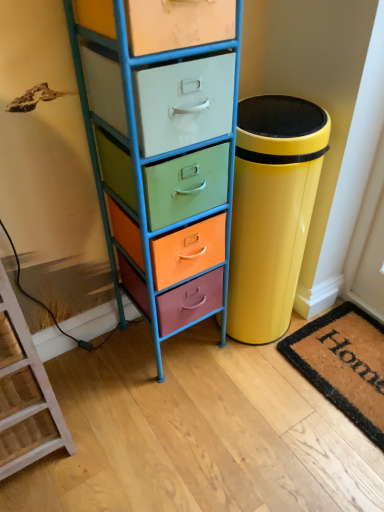
Question: Is wooden ladder at lower left closer to camera compared to coir doormat at lower right?

Choices:
 (A) no
 (B) yes

Answer: (B)

Question: Considering the relative positions of wooden ladder at lower left and coir doormat at lower right in the image provided, is wooden ladder at lower left to the right of coir doormat at lower right from the viewer's perspective?

Choices:
 (A) yes
 (B) no

Answer: (B)

Question: From the image's perspective, is wooden ladder at lower left under coir doormat at lower right?

Choices:
 (A) yes
 (B) no

Answer: (B)

Question: Is wooden ladder at lower left facing away from coir doormat at lower right?

Choices:
 (A) no
 (B) yes

Answer: (A)

Question: Could you tell me if wooden ladder at lower left is turned towards coir doormat at lower right?

Choices:
 (A) yes
 (B) no

Answer: (B)

Question: Does wooden ladder at lower left have a smaller size compared to coir doormat at lower right?

Choices:
 (A) yes
 (B) no

Answer: (B)

Question: Does glossy yellow trash can at right appear on the right side of wooden ladder at lower left?

Choices:
 (A) no
 (B) yes

Answer: (B)

Question: Is glossy yellow trash can at right looking in the opposite direction of wooden ladder at lower left?

Choices:
 (A) no
 (B) yes

Answer: (A)

Question: Does glossy yellow trash can at right lie behind wooden ladder at lower left?

Choices:
 (A) no
 (B) yes

Answer: (B)

Question: Would you say glossy yellow trash can at right is a long distance from wooden ladder at lower left?

Choices:
 (A) no
 (B) yes

Answer: (A)

Question: Can we say glossy yellow trash can at right lies outside wooden ladder at lower left?

Choices:
 (A) no
 (B) yes

Answer: (B)

Question: Can you confirm if glossy yellow trash can at right is taller than wooden ladder at lower left?

Choices:
 (A) yes
 (B) no

Answer: (B)

Question: Does glossy yellow trash can at right have a larger size compared to coir doormat at lower right?

Choices:
 (A) yes
 (B) no

Answer: (A)